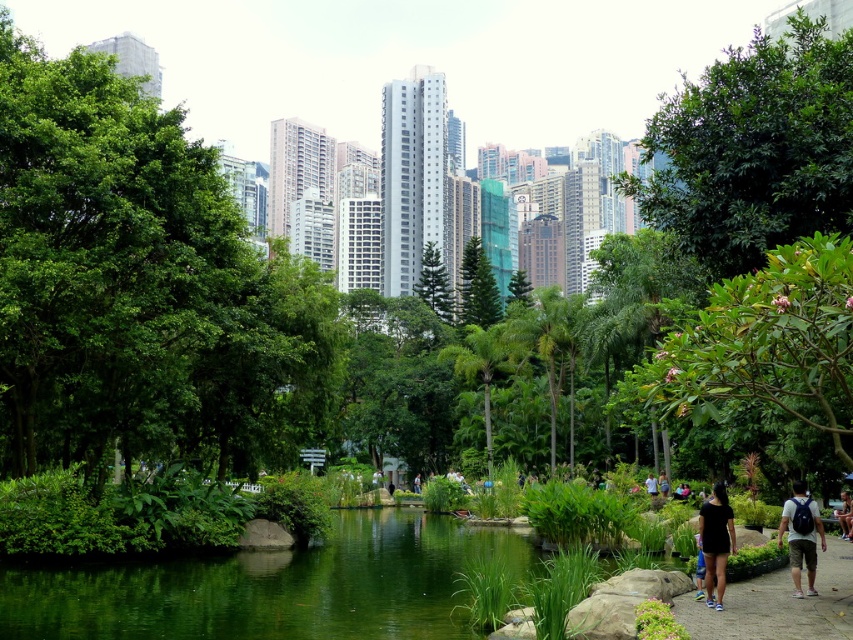
Does dark gray backpack at lower right have a lesser width compared to black cotton shirt at center?

In fact, dark gray backpack at lower right might be wider than black cotton shirt at center.

Looking at this image, who is positioned more to the right, dark gray backpack at lower right or black cotton shirt at center?

From the viewer's perspective, black cotton shirt at center appears more on the right side.

Is point (799, 506) positioned before point (654, 492)?

That is True.

At what (x,y) coordinates should I click in order to perform the action: click on dark gray backpack at lower right. Please return your answer as a coordinate pair (x, y). Image resolution: width=853 pixels, height=640 pixels. Looking at the image, I should click on (799, 538).

Who is lower down, green leafy tree at upper right or black fabric at lower right?

black fabric at lower right is below.

What do you see at coordinates (753, 148) in the screenshot?
I see `green leafy tree at upper right` at bounding box center [753, 148].

Does point (833, 65) come closer to viewer compared to point (724, 515)?

No.

This screenshot has height=640, width=853. Find the location of `green leafy tree at upper right`. green leafy tree at upper right is located at coordinates (753, 148).

Can you confirm if black fabric at lower right is thinner than green textured tree at center?

Yes.

Who is shorter, black fabric at lower right or green textured tree at center?

black fabric at lower right

Is point (709, 552) positioned behind point (425, 252)?

No, (709, 552) is closer to viewer.

Find the location of `black fabric at lower right`. black fabric at lower right is located at coordinates (717, 541).